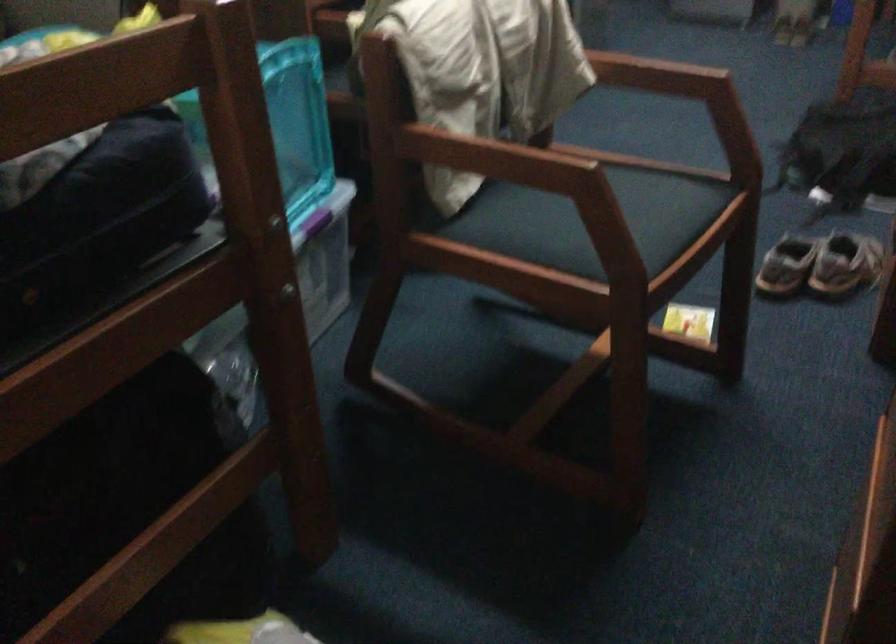
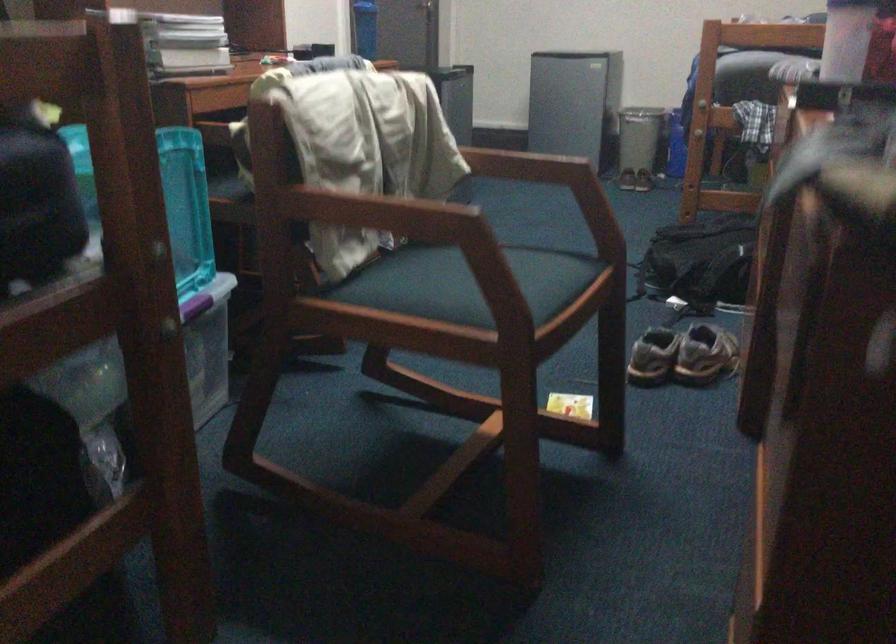
Question: How did the camera likely rotate?

Choices:
 (A) Left
 (B) Right
 (C) Up
 (D) Down

Answer: (C)